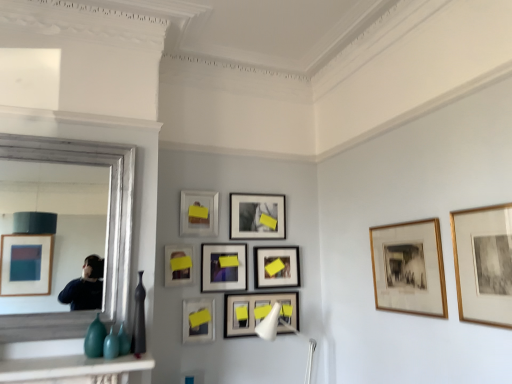
Where is `vacant space situated above silver framed mirror at left (from a real-world perspective)`? vacant space situated above silver framed mirror at left (from a real-world perspective) is located at coordinates (75, 133).